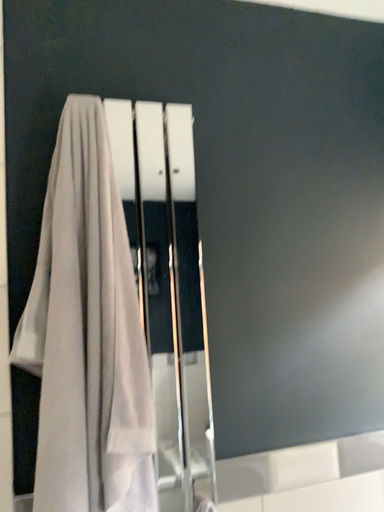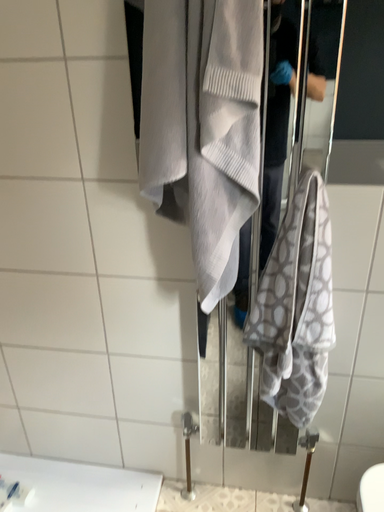
Question: Which way did the camera rotate in the video?

Choices:
 (A) rotated downward
 (B) rotated upward

Answer: (A)